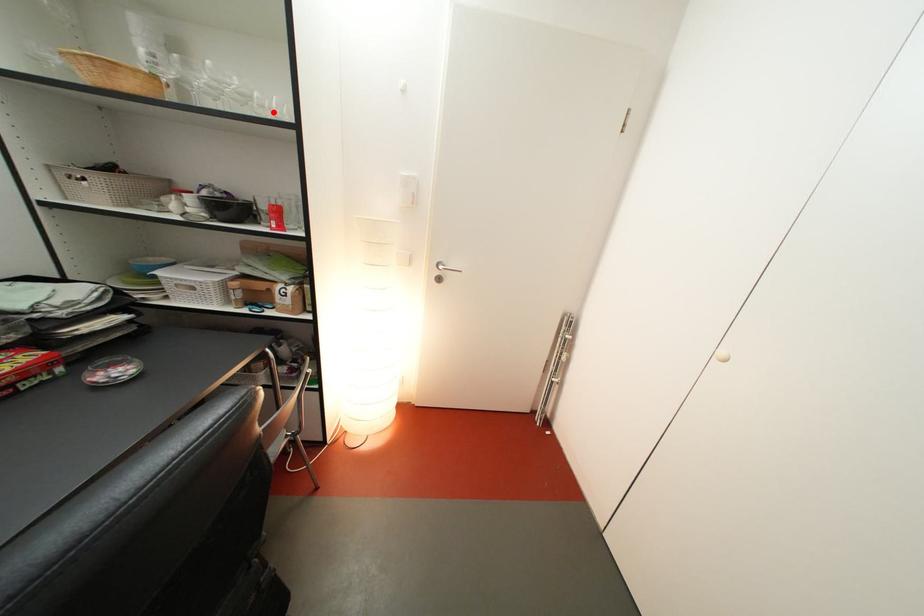
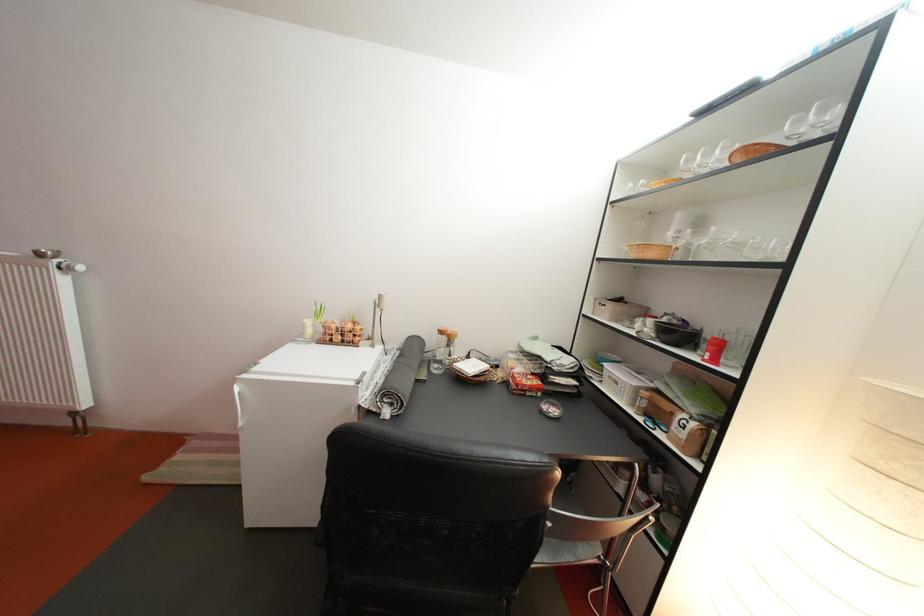
Question: I am providing you with two images of the same scene from different viewpoints. A red point is marked on the first image. Can you still see the location of the red point in image 2?

Choices:
 (A) Yes
 (B) No

Answer: (A)